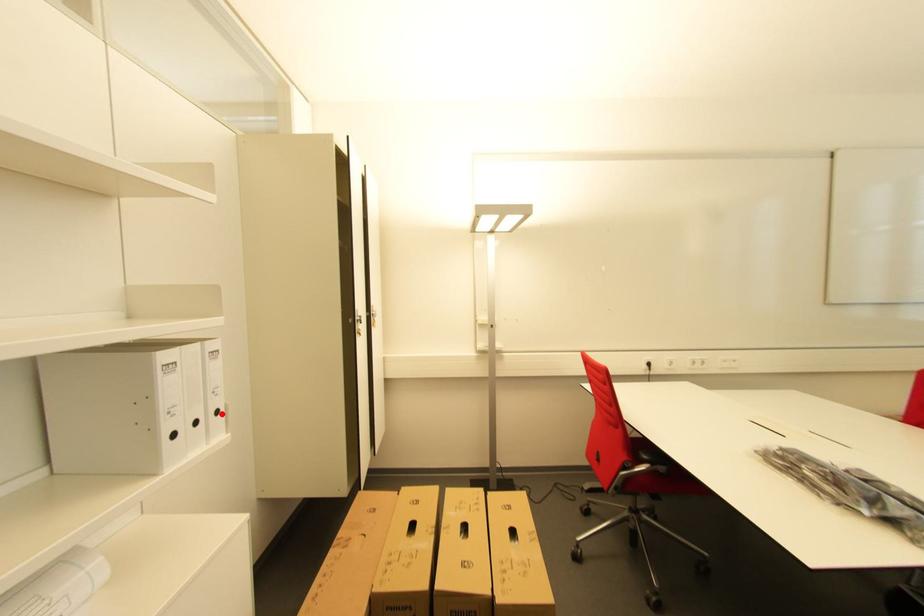
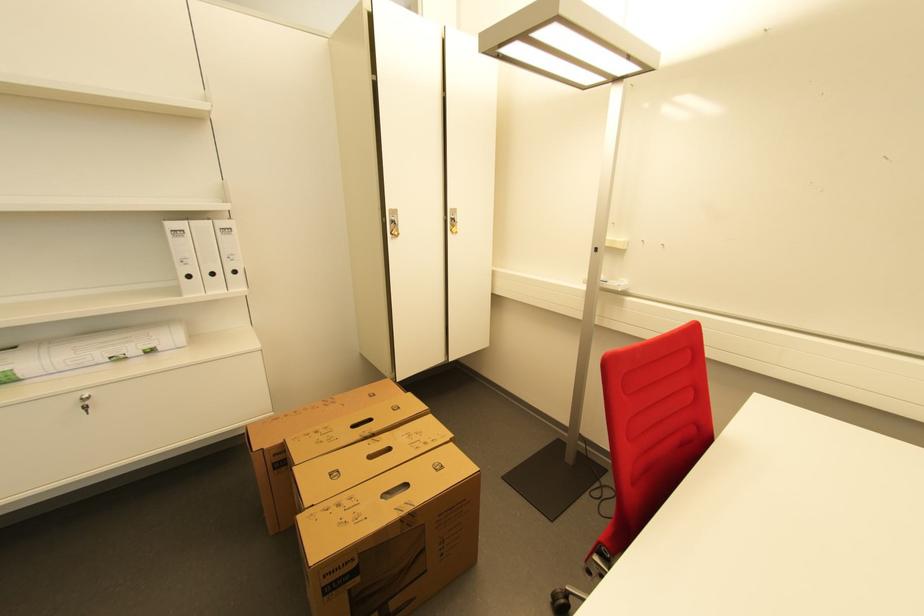
Find the pixel in the second image that matches the highlighted location in the first image.

(239, 273)